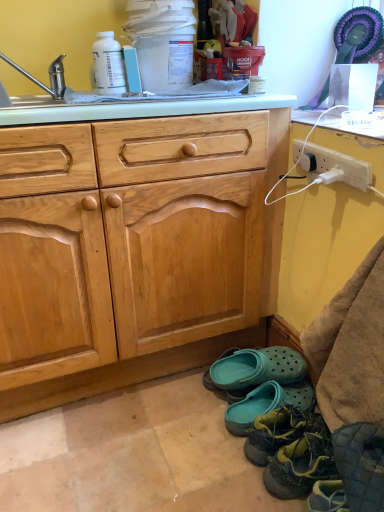
Question: Does teal rubber clogs at lower center, which ranks as the second footwear in back-to-front order, appear on the left side of green rubber shoes at lower right, the fourth footwear positioned from the back?

Choices:
 (A) yes
 (B) no

Answer: (A)

Question: Is teal rubber clogs at lower center, placed as the third footwear when sorted from front to back, completely or partially outside of green rubber shoes at lower right, acting as the first footwear starting from the front?

Choices:
 (A) no
 (B) yes

Answer: (B)

Question: Is green rubber shoes at lower right, the fourth footwear positioned from the back, located within teal rubber clogs at lower center, placed as the third footwear when sorted from front to back?

Choices:
 (A) yes
 (B) no

Answer: (B)

Question: From the image's perspective, is teal rubber clogs at lower center, placed as the third footwear when sorted from front to back, on top of green rubber shoes at lower right, acting as the first footwear starting from the front?

Choices:
 (A) yes
 (B) no

Answer: (A)

Question: Can you see teal rubber clogs at lower center, placed as the third footwear when sorted from front to back, touching green rubber shoes at lower right, the fourth footwear positioned from the back?

Choices:
 (A) yes
 (B) no

Answer: (B)

Question: Is teal rubber clogs at lower center, placed as the third footwear when sorted from front to back, aimed at green rubber shoes at lower right, acting as the first footwear starting from the front?

Choices:
 (A) no
 (B) yes

Answer: (A)

Question: Is white plastic power outlet at right not near brushed metal faucet at upper left?

Choices:
 (A) yes
 (B) no

Answer: (B)

Question: Can you confirm if white plastic power outlet at right is bigger than brushed metal faucet at upper left?

Choices:
 (A) no
 (B) yes

Answer: (A)

Question: Is white plastic power outlet at right not within brushed metal faucet at upper left?

Choices:
 (A) no
 (B) yes

Answer: (B)

Question: Is white plastic power outlet at right oriented away from brushed metal faucet at upper left?

Choices:
 (A) yes
 (B) no

Answer: (B)

Question: From the image's perspective, is white plastic power outlet at right located above brushed metal faucet at upper left?

Choices:
 (A) no
 (B) yes

Answer: (A)

Question: Is white plastic power outlet at right behind brushed metal faucet at upper left?

Choices:
 (A) no
 (B) yes

Answer: (A)

Question: Is white plastic power outlet at right outside of white plastic bottle at upper left?

Choices:
 (A) yes
 (B) no

Answer: (A)